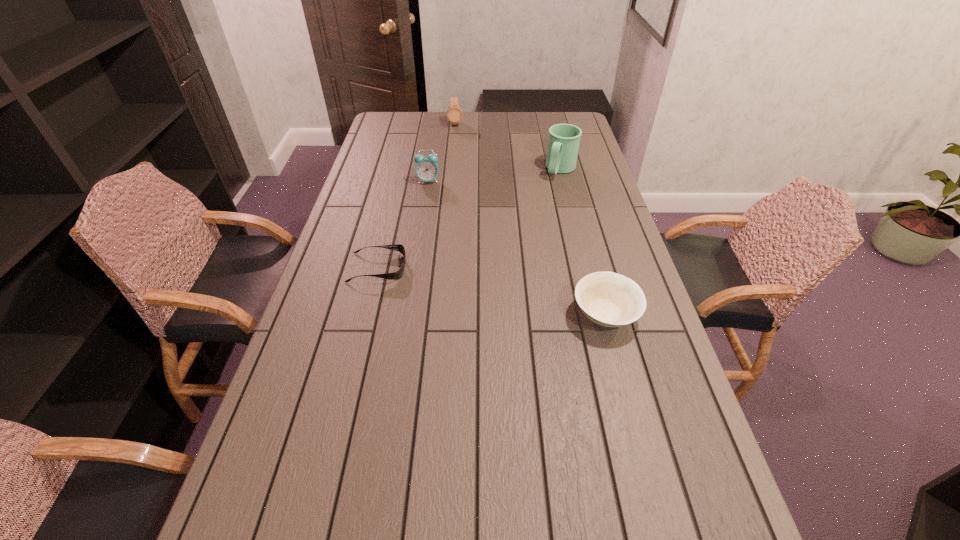
You are a GUI agent. You are given a task and a screenshot of the screen. Output one action in this format:
    pyautogui.click(x=<x>, y=<y>)
    Task: Click on the free space on the desktop that is between the fourth farthest object and the bowl and is positioned on the face of the farthest object
    
    Given the screenshot: What is the action you would take?
    pyautogui.click(x=468, y=286)

Locate an element on the screen. The width and height of the screenshot is (960, 540). free spot on the desktop that is between the fourth farthest object and the nearest object and is positioned on the face of the alarm clock is located at coordinates (469, 287).

Image resolution: width=960 pixels, height=540 pixels. Identify the location of vacant space on the desktop that is between the sunglasses and the second shortest object and is positioned on the side of the tallest object with the handle. (481, 289).